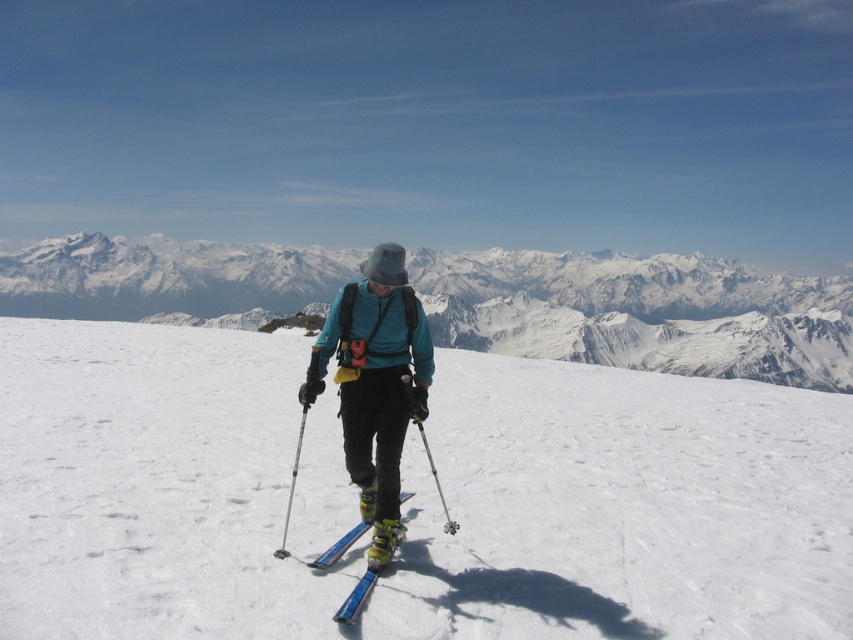
You are a photographer trying to capture the skier and their equipment in a balanced composition. Given the white matte snow at center and the metallic silver ski pole at center, which object should you adjust your focus to ensure the ski pole isn not overwhelmed by the snow?

The white matte snow at center is wider than the metallic silver ski pole at center. To prevent the ski pole from being overwhelmed, focus on the ski pole and frame it within the snow area so its smaller size contrasts effectively with the broader snow coverage.

Looking at this image, you are a photographer positioned at the base of the mountain. You want to take a photo that includes both the point at coordinates point (379, 328) and point (450, 524). Which point should you focus on first to ensure both are in sharp focus?

You should focus on point (379, 328) first because it is closer to the camera than point (450, 524). This ensures both points will be in focus as the closer point determines the focal plane.

You are a drone operator trying to capture the best aerial shot of the skier and the mountain. You have two points marked on your screen, point A at coordinates point (641, 388) and point B at coordinates point (424, 445). Which point is closer to the camera to ensure the skier is in focus?

Point A at coordinates point (641, 388) is closer to the camera since it is further to the viewer than point B at coordinates point (424, 445), making it better for focusing on the skier.